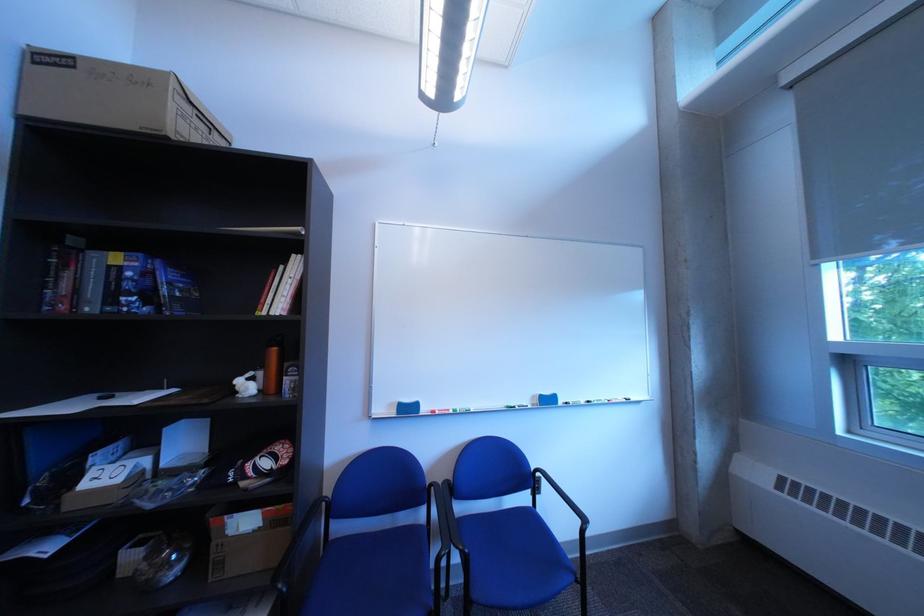
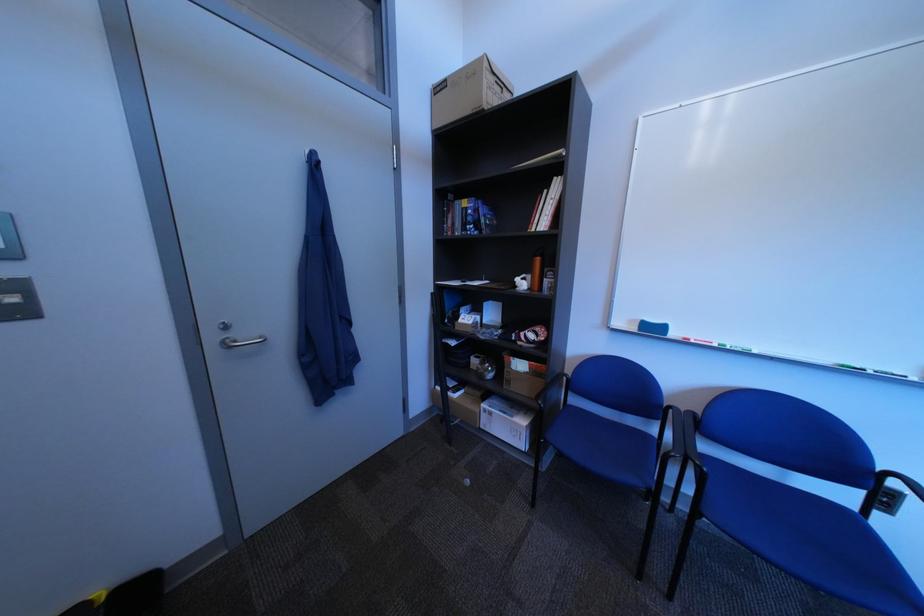
Find the pixel in the second image that matches the point at 406,407 in the first image.

(647, 323)